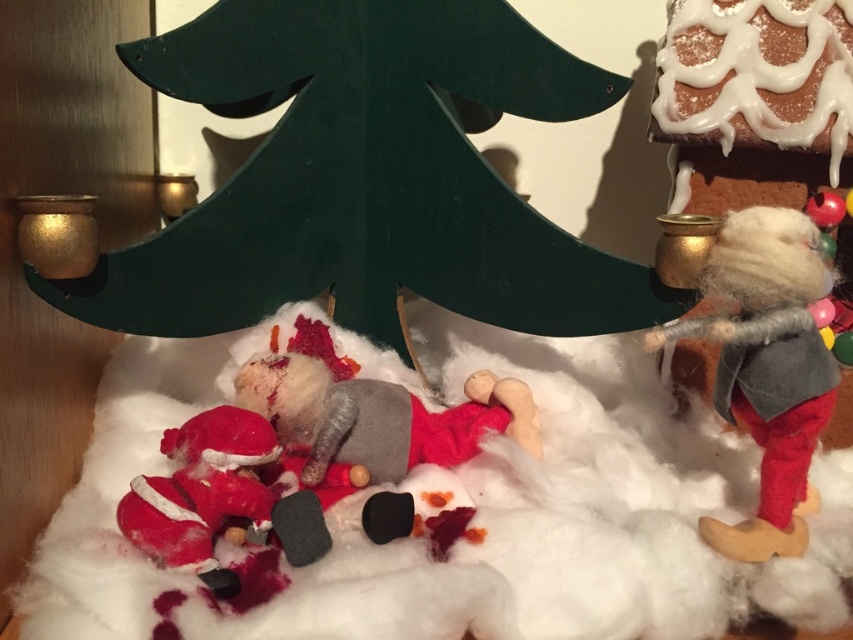
Question: Which of the following is the farthest from the observer?

Choices:
 (A) fuzzy woolen elf at right
 (B) fuzzy red santa at lower left

Answer: (A)

Question: Which object is farther from the camera taking this photo?

Choices:
 (A) fuzzy woolen elf at right
 (B) fuzzy red santa at lower left

Answer: (A)

Question: Does fuzzy woolen elf at right have a greater width compared to fuzzy red santa at lower left?

Choices:
 (A) no
 (B) yes

Answer: (B)

Question: Is fuzzy woolen elf at right wider than fuzzy red santa at lower left?

Choices:
 (A) no
 (B) yes

Answer: (B)

Question: In this image, where is fuzzy woolen elf at right located relative to fuzzy red santa at lower left?

Choices:
 (A) left
 (B) right

Answer: (B)

Question: Which point is closer to the camera taking this photo?

Choices:
 (A) (241, 456)
 (B) (737, 218)

Answer: (B)